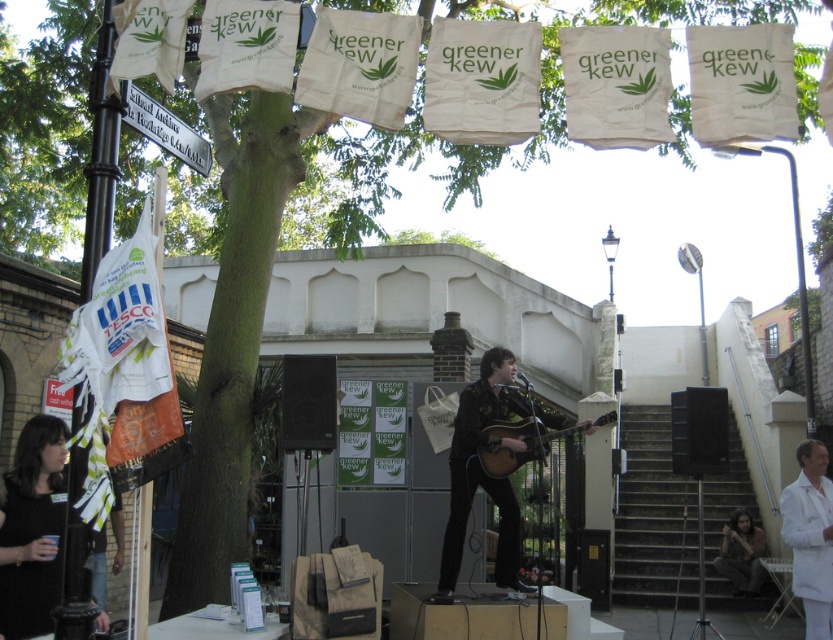
Question: Does black fabric shirt at lower left have a larger size compared to acoustic wood guitar at center?

Choices:
 (A) no
 (B) yes

Answer: (A)

Question: Among these points, which one is farthest from the camera?

Choices:
 (A) (747, 570)
 (B) (811, 483)

Answer: (A)

Question: Is the position of black fabric shirt at lower left less distant than that of acoustic wood guitar at center?

Choices:
 (A) no
 (B) yes

Answer: (B)

Question: Which point appears farthest from the camera in this image?

Choices:
 (A) (826, 611)
 (B) (560, 429)

Answer: (A)

Question: Considering the relative positions of black fabric shirt at lower left and matte black guitar at center in the image provided, where is black fabric shirt at lower left located with respect to matte black guitar at center?

Choices:
 (A) left
 (B) right

Answer: (A)

Question: Among these points, which one is nearest to the camera?

Choices:
 (A) (3, 612)
 (B) (727, 524)

Answer: (A)